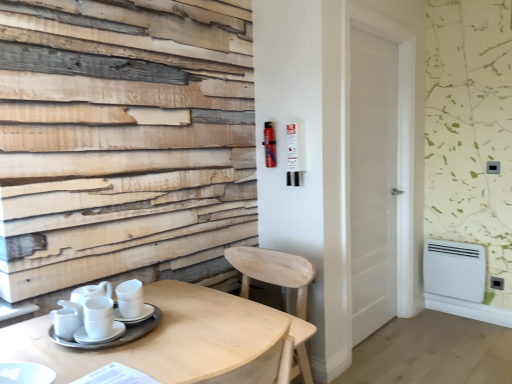
Find the location of `vacant region to the right of white wooden door at center`. vacant region to the right of white wooden door at center is located at coordinates (435, 337).